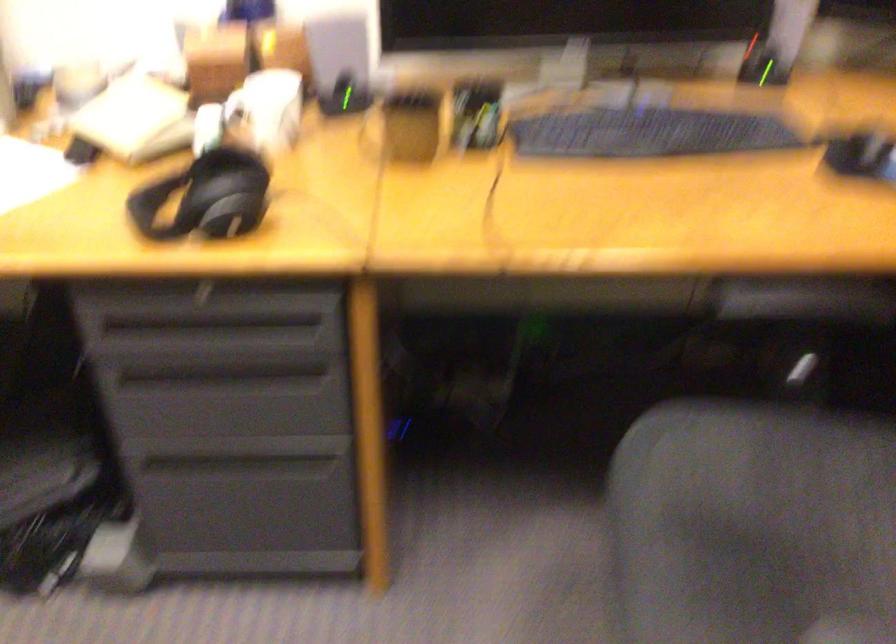
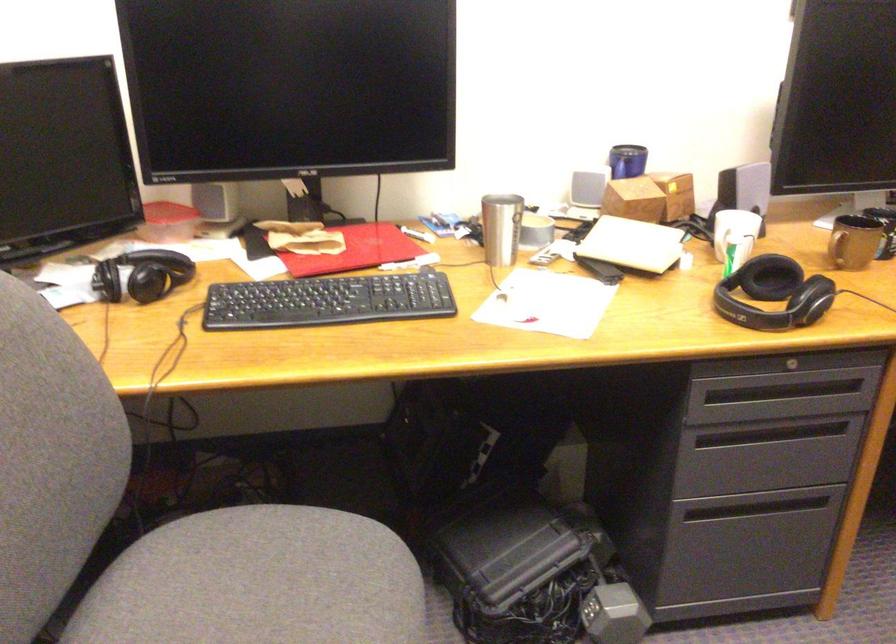
Find the pixel in the second image that matches point 220,221 in the first image.

(810, 299)